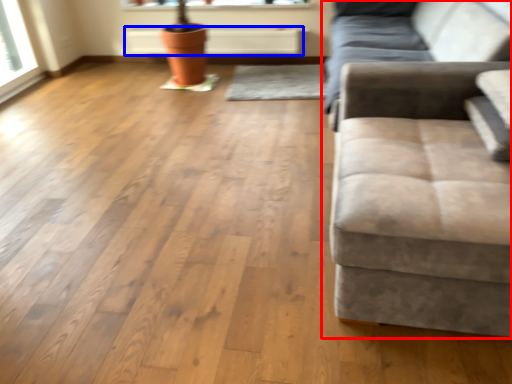
Question: Among these objects, which one is nearest to the camera, studio couch (highlighted by a red box) or radiator (highlighted by a blue box)?

Choices:
 (A) studio couch
 (B) radiator

Answer: (A)